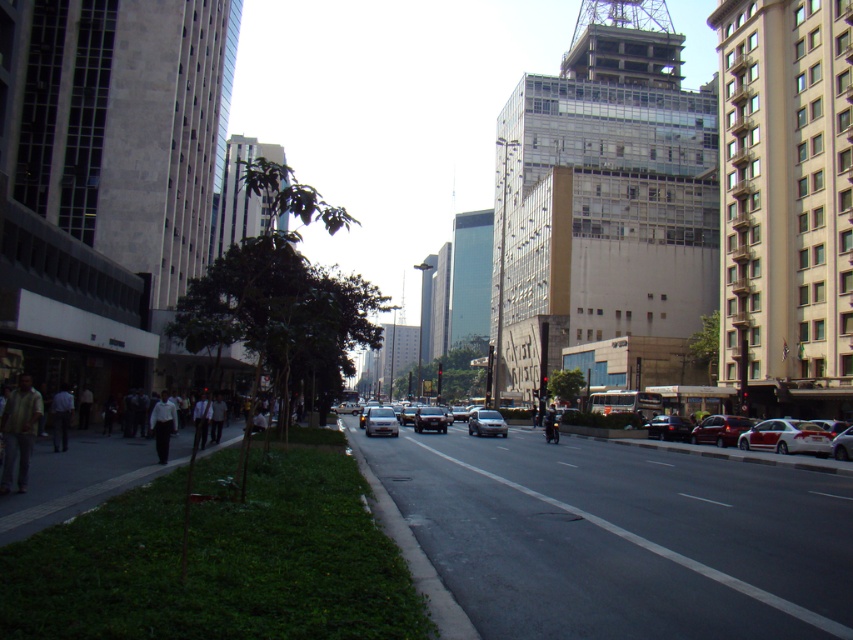
Looking at this image, you are standing on the sidewalk in the urban street scene. There is a point marked at coordinates (161, 424). What object is located at that point?

The white shirt at center is located at point (161, 424).